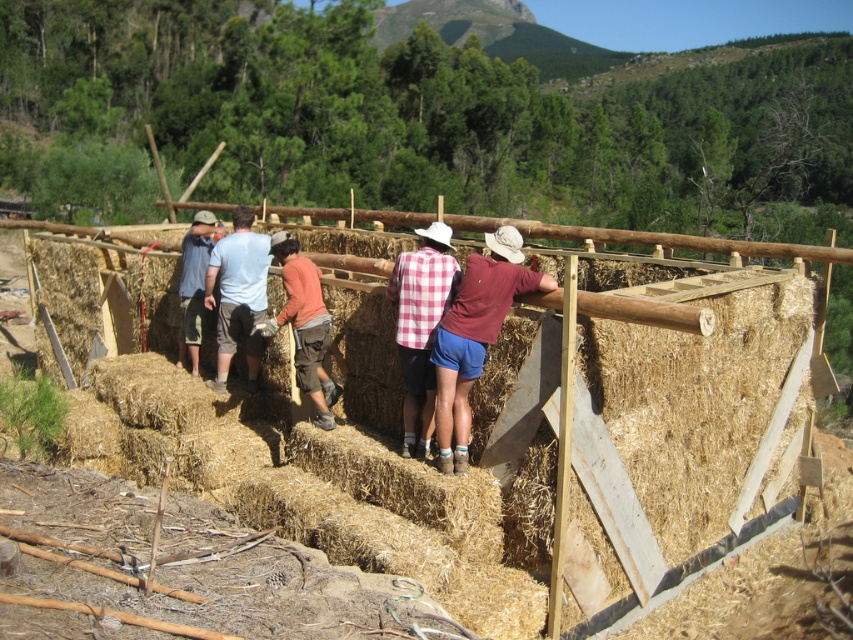
Locate an element on the screen. The height and width of the screenshot is (640, 853). plaid fabric shirt at center is located at coordinates (421, 324).

Does plaid fabric shirt at center have a greater height compared to blue denim jeans at center?

No, plaid fabric shirt at center is not taller than blue denim jeans at center.

This screenshot has height=640, width=853. I want to click on plaid fabric shirt at center, so click(x=421, y=324).

Which is below, natural straw bales at center or blue denim jeans at center?

natural straw bales at center

This screenshot has height=640, width=853. Find the location of `natural straw bales at center`. natural straw bales at center is located at coordinates (688, 433).

Is point (753, 474) farther from camera compared to point (202, 269)?

No, it is not.

The image size is (853, 640). I want to click on natural straw bales at center, so click(x=688, y=433).

Does natural straw bales at center have a greater height compared to orange shirt at center?

Incorrect, natural straw bales at center's height is not larger of orange shirt at center's.

Is natural straw bales at center above orange shirt at center?

Correct, natural straw bales at center is located above orange shirt at center.

Is point (636, 419) closer to viewer compared to point (322, 355)?

Yes, point (636, 419) is in front of point (322, 355).

Locate an element on the screen. This screenshot has height=640, width=853. natural straw bales at center is located at coordinates (688, 433).